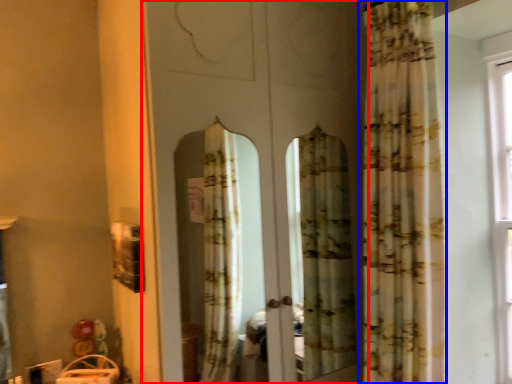
Question: Which of the following is the farthest to the observer, screen door (highlighted by a red box) or curtain (highlighted by a blue box)?

Choices:
 (A) screen door
 (B) curtain

Answer: (B)